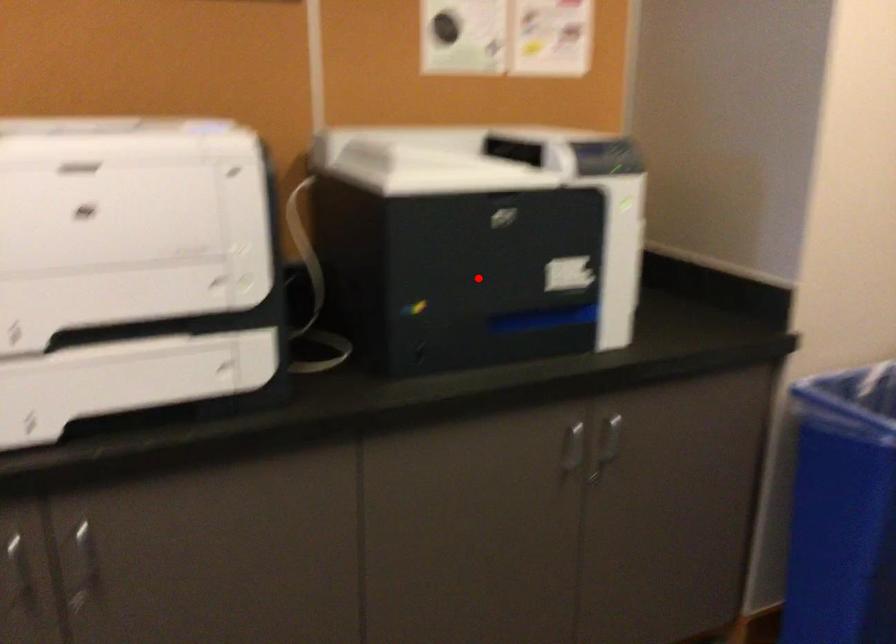
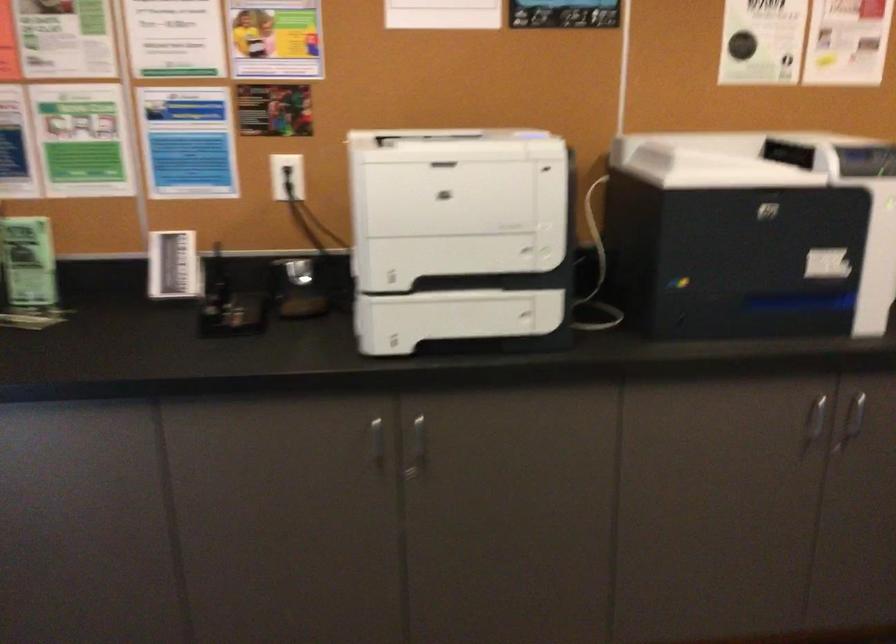
The point at the highlighted location is marked in the first image. Where is the corresponding point in the second image?

(737, 259)